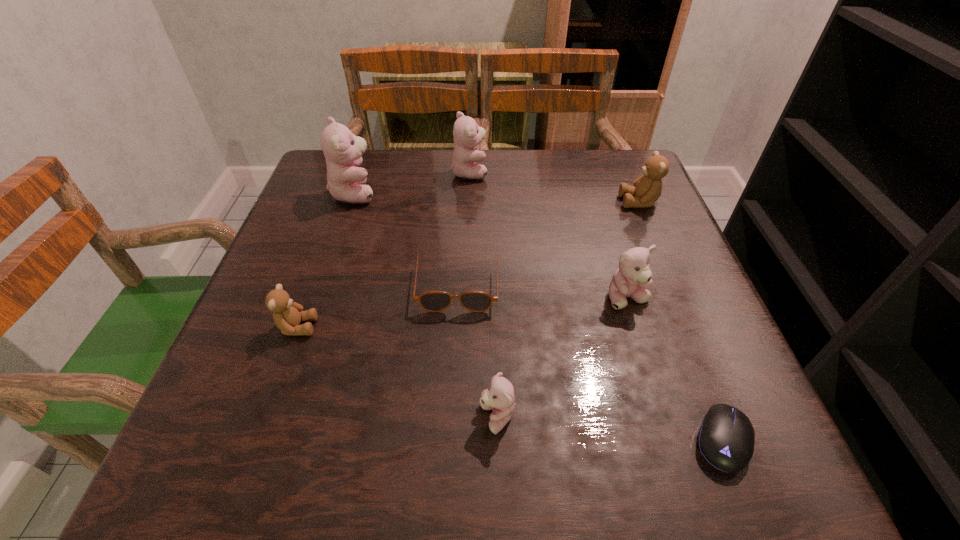
Identify which object is the second nearest to the fifth shortest teddy bear. Please provide its 2D coordinates. Your answer should be formatted as a tuple, i.e. [(x, y)], where the tuple contains the x and y coordinates of a point satisfying the conditions above.

[(432, 301)]

Where is `object that is the fifth closest to the third biggest pink teddy bear`? This screenshot has height=540, width=960. object that is the fifth closest to the third biggest pink teddy bear is located at coordinates (467, 134).

The image size is (960, 540). What are the coordinates of `teddy bear identified as the fifth closest to the second smallest pink teddy bear` in the screenshot? It's located at (343, 151).

Identify which teddy bear is the fifth closest to the second biggest pink teddy bear. Please provide its 2D coordinates. Your answer should be formatted as a tuple, i.e. [(x, y)], where the tuple contains the x and y coordinates of a point satisfying the conditions above.

[(499, 397)]

Find the location of `the second closest pink teddy bear to the farther brown teddy bear`. the second closest pink teddy bear to the farther brown teddy bear is located at coordinates (467, 134).

Where is `pink teddy bear that stands as the third closest to the brown sunglasses`? The width and height of the screenshot is (960, 540). pink teddy bear that stands as the third closest to the brown sunglasses is located at coordinates (633, 278).

Identify the location of free location that satisfies the following two spatial constraints: 1. on the front-facing side of the seventh tallest object; 2. on the face of the smaller brown teddy bear. This screenshot has width=960, height=540. (456, 327).

Locate an element on the screen. Image resolution: width=960 pixels, height=540 pixels. vacant space that satisfies the following two spatial constraints: 1. at the face of the third farthest pink teddy bear; 2. at the face of the nearest teddy bear is located at coordinates (664, 417).

Where is `vacant space that satisfies the following two spatial constraints: 1. on the front-facing side of the brown sunglasses; 2. on the right side of the shortest object`? vacant space that satisfies the following two spatial constraints: 1. on the front-facing side of the brown sunglasses; 2. on the right side of the shortest object is located at coordinates (450, 440).

Identify the location of free space that satisfies the following two spatial constraints: 1. at the face of the rightmost pink teddy bear; 2. on the face of the left brown teddy bear. (636, 327).